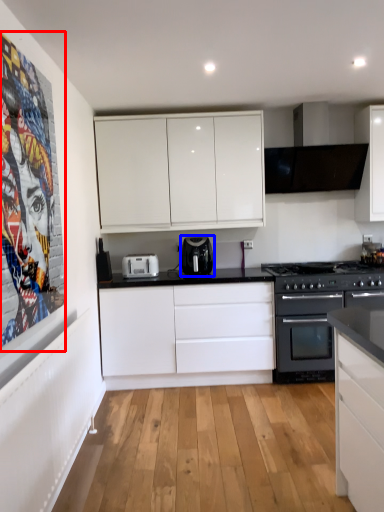
Question: Which object appears closest to the camera in this image, poster page (highlighted by a red box) or kitchen appliance (highlighted by a blue box)?

Choices:
 (A) poster page
 (B) kitchen appliance

Answer: (A)